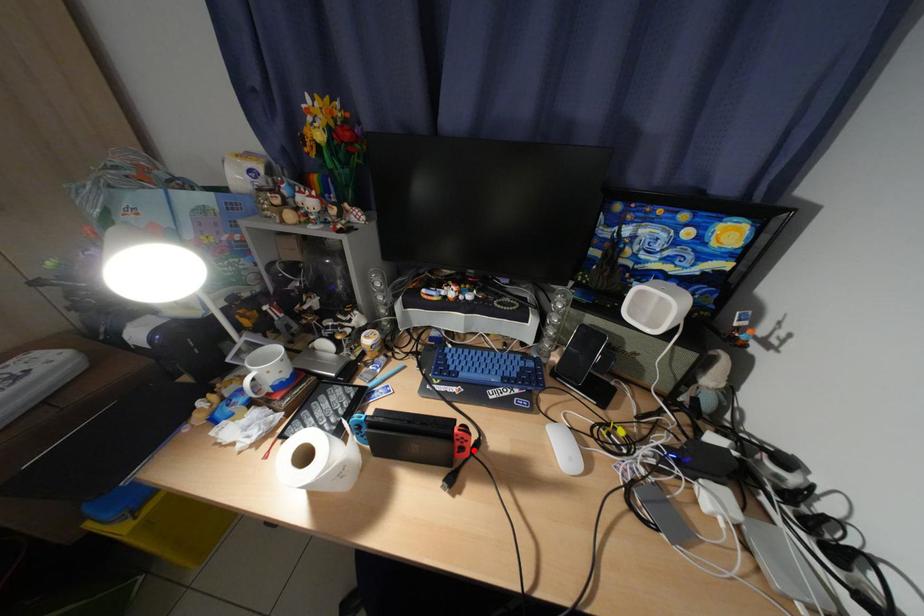
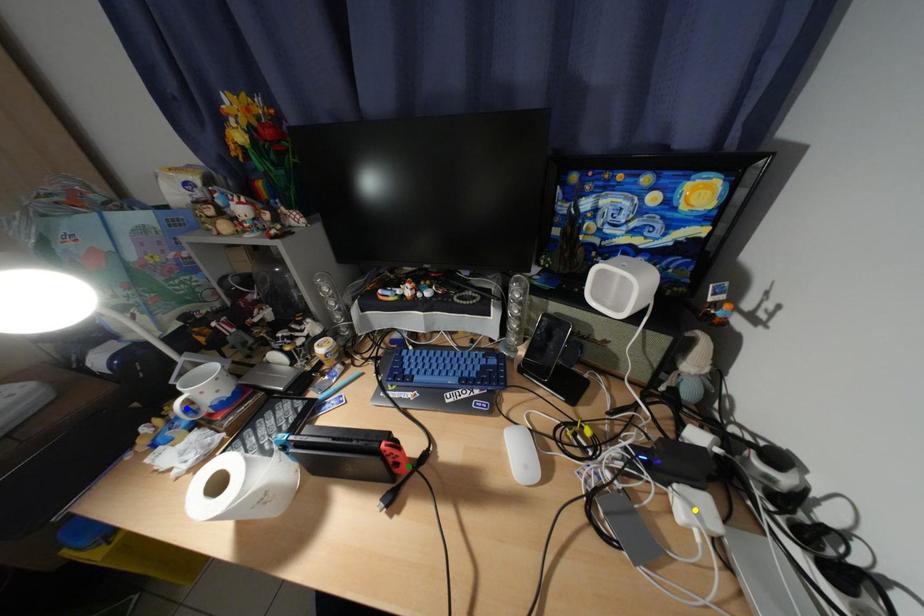
Question: I am providing you with two images of the same scene from different viewpoints. A red point is marked on the first image. You are given multiple points on the second image. Which spot in image 2 lines up with the point in image 1?

Choices:
 (A) blue point
 (B) yellow point
 (C) green point

Answer: (C)